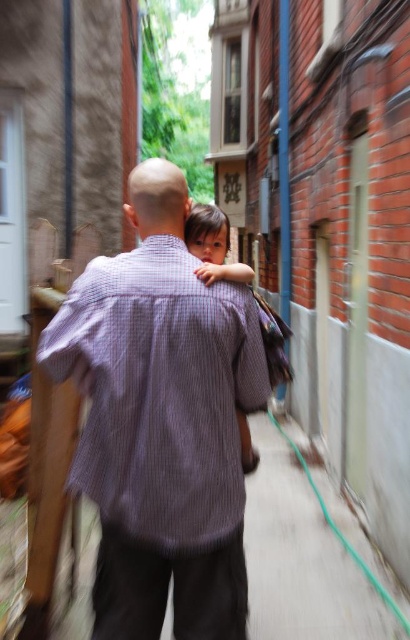
Find the location of a particular element. Image resolution: width=410 pixels, height=640 pixels. purple corduroy shirt at center is located at coordinates (161, 420).

Who is higher up, purple corduroy shirt at center or smooth skin child at center?

Positioned higher is smooth skin child at center.

Find the location of a particular element. The width and height of the screenshot is (410, 640). purple corduroy shirt at center is located at coordinates (161, 420).